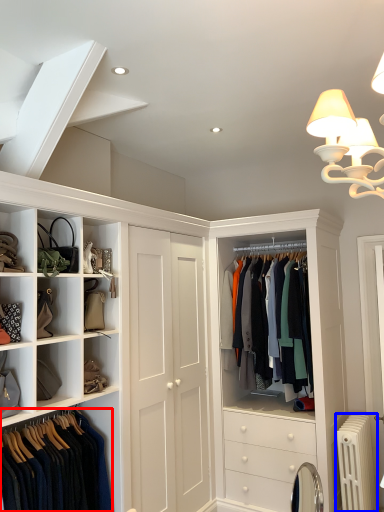
Question: Which point is further to the camera, clothing (highlighted by a red box) or radiator (highlighted by a blue box)?

Choices:
 (A) clothing
 (B) radiator

Answer: (B)